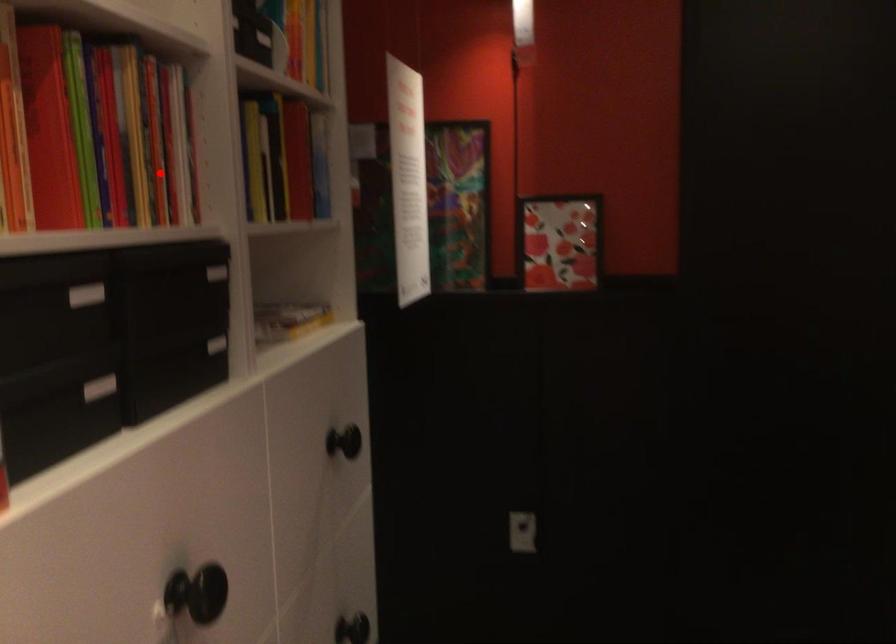
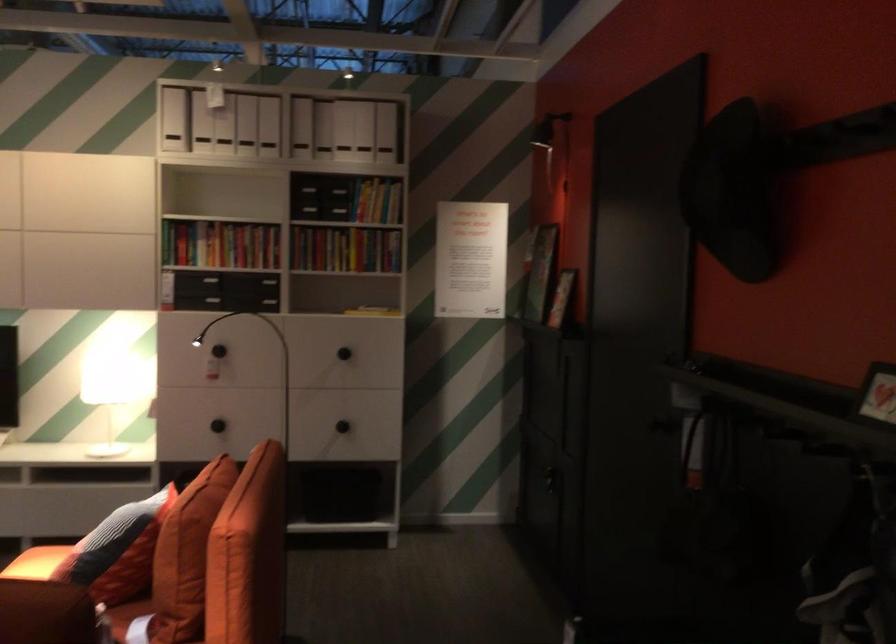
In the second image, find the point that corresponds to the highlighted location in the first image.

(220, 243)